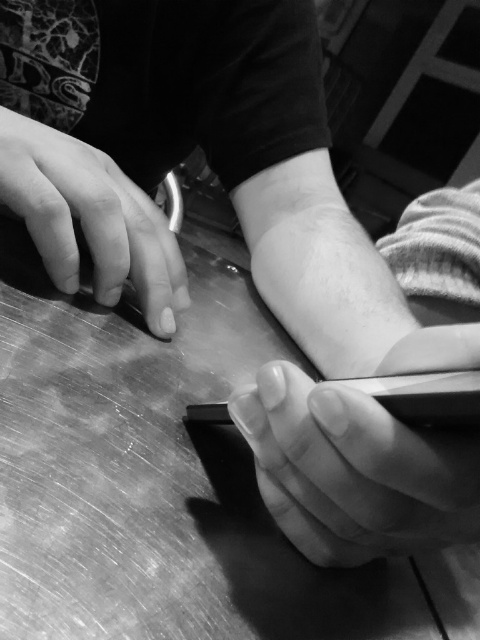
Can you confirm if metallic polished table at center is positioned below smooth skin at lower right?

No.

Does metallic polished table at center have a larger size compared to smooth skin at lower right?

Correct, metallic polished table at center is larger in size than smooth skin at lower right.

At what (x,y) coordinates should I click in order to perform the action: click on metallic polished table at center. Please return your answer as a coordinate pair (x, y). This screenshot has width=480, height=640. Looking at the image, I should click on (168, 481).

Does smooth skin at lower right have a lesser width compared to smooth skin at left?

Indeed, smooth skin at lower right has a lesser width compared to smooth skin at left.

Based on the photo, who is positioned more to the left, smooth skin at lower right or smooth skin at left?

From the viewer's perspective, smooth skin at left appears more on the left side.

The width and height of the screenshot is (480, 640). Describe the element at coordinates (354, 470) in the screenshot. I see `smooth skin at lower right` at that location.

Find the location of a particular element. smooth skin at lower right is located at coordinates (354, 470).

How far apart are metallic polished table at center and smooth skin at left?

A distance of 4.66 inches exists between metallic polished table at center and smooth skin at left.

Which is in front, point (6, 228) or point (135, 244)?

Point (135, 244)

This screenshot has height=640, width=480. What are the coordinates of `metallic polished table at center` in the screenshot? It's located at (168, 481).